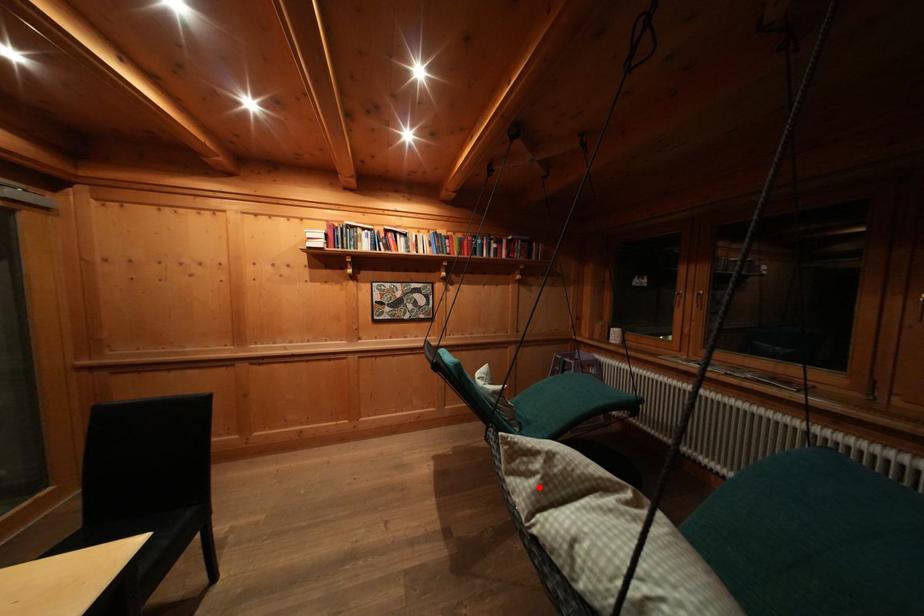
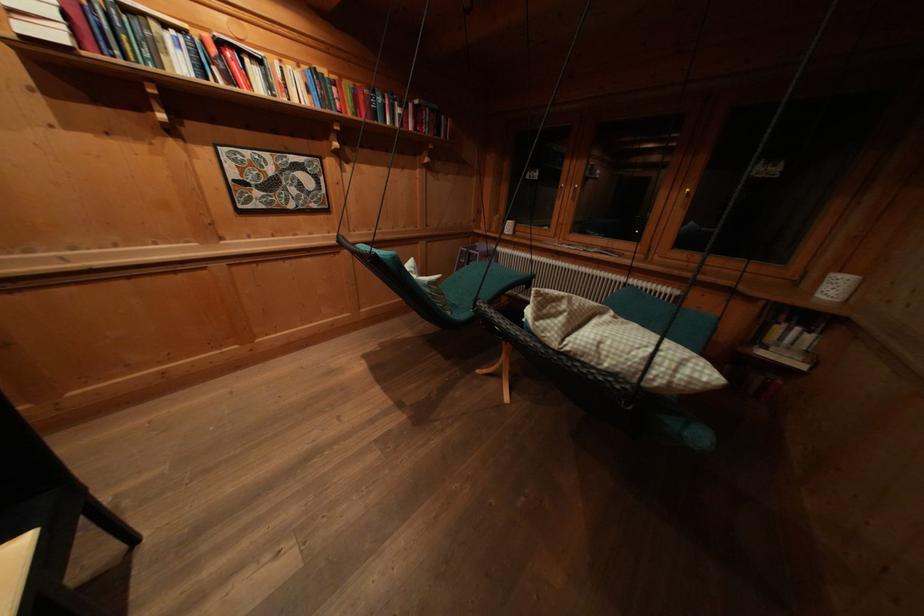
Where in the second image is the point corresponding to the highlighted location from the first image?

(567, 323)